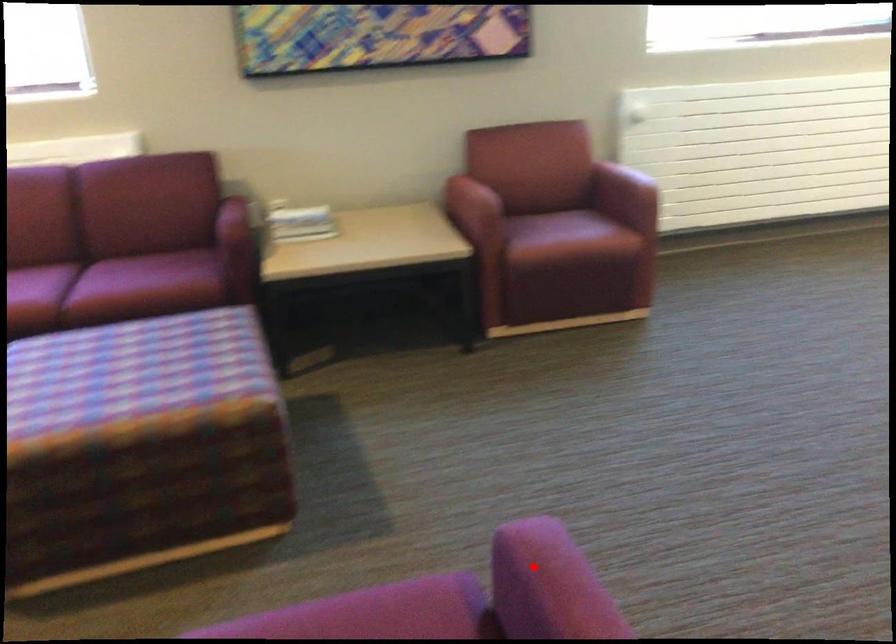
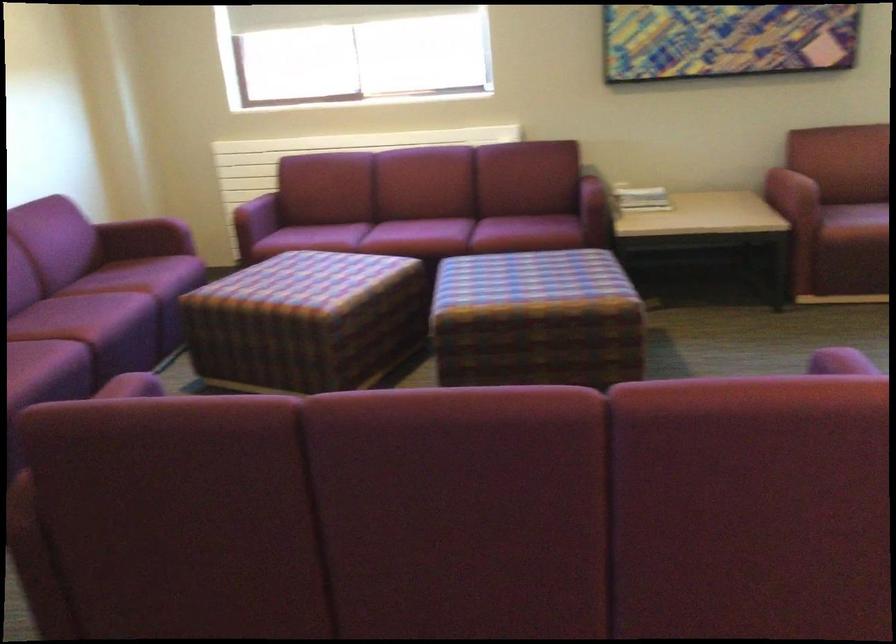
Find the pixel in the second image that matches the highlighted location in the first image.

(840, 362)